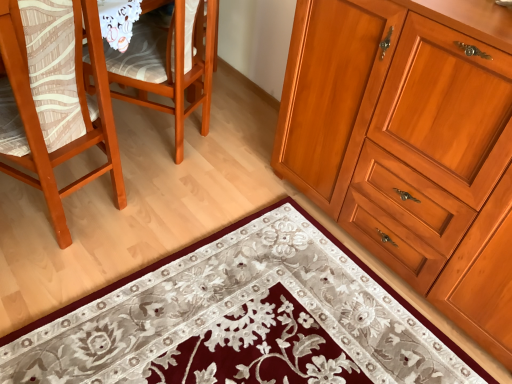
Find the location of a particular element. free point below wooden chair at left, placed as the 2th chair when sorted from left to right (from a real-world perspective) is located at coordinates (160, 140).